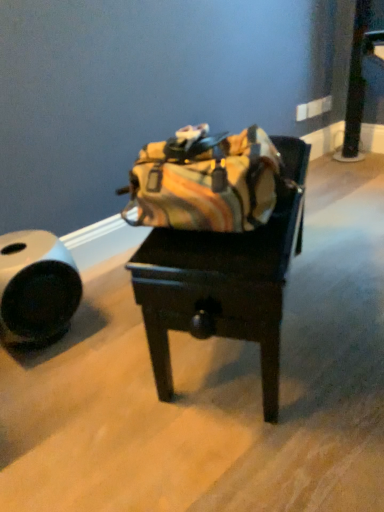
Measure the distance between point (26, 261) and camera.

The depth of point (26, 261) is 4.03 feet.

The width and height of the screenshot is (384, 512). What do you see at coordinates (36, 287) in the screenshot?
I see `white matte tube at left` at bounding box center [36, 287].

At what (x,y) coordinates should I click in order to perform the action: click on white matte tube at left. Please return your answer as a coordinate pair (x, y). The image size is (384, 512). Looking at the image, I should click on (36, 287).

This screenshot has width=384, height=512. Describe the element at coordinates (224, 280) in the screenshot. I see `leather duffel bag at center` at that location.

Where is `leather duffel bag at center`? leather duffel bag at center is located at coordinates (224, 280).

The image size is (384, 512). What are the coordinates of `white matte tube at left` in the screenshot? It's located at (36, 287).

Looking at this image, considering the relative positions of leather duffel bag at center and white matte tube at left in the image provided, is leather duffel bag at center to the right of white matte tube at left from the viewer's perspective?

Yes, leather duffel bag at center is to the right of white matte tube at left.

Is leather duffel bag at center in front of or behind white matte tube at left in the image?

Visually, leather duffel bag at center is located in front of white matte tube at left.

Is point (229, 281) positioned in front of point (30, 339)?

Yes, it is in front of point (30, 339).

From the picture: From the image's perspective, is leather duffel bag at center below white matte tube at left?

No, from the image's perspective, leather duffel bag at center is not below white matte tube at left.

From a real-world perspective, which is physically above, leather duffel bag at center or white matte tube at left?

leather duffel bag at center, from a real-world perspective.

Looking at this image, is leather duffel bag at center thinner than white matte tube at left?

No.

Does leather duffel bag at center have a lesser height compared to white matte tube at left?

Incorrect, the height of leather duffel bag at center does not fall short of that of white matte tube at left.

Who is bigger, leather duffel bag at center or white matte tube at left?

leather duffel bag at center is bigger.

Is white matte tube at left surrounded by leather duffel bag at center?

Actually, white matte tube at left is outside leather duffel bag at center.

Is leather duffel bag at center in contact with white matte tube at left?

No.

Is leather duffel bag at center positioned with its back to white matte tube at left?

Yes.

Find the location of `tube directly beneath the leather duffel bag at center (from a real-world perspective)`. tube directly beneath the leather duffel bag at center (from a real-world perspective) is located at coordinates (36, 287).

Based on their positions, is white matte tube at left located to the left or right of leather duffel bag at center?

Based on their positions, white matte tube at left is located to the left of leather duffel bag at center.

Between white matte tube at left and leather duffel bag at center, which one is positioned behind?

white matte tube at left.

Does point (65, 316) lie in front of point (246, 325)?

No, (65, 316) is behind (246, 325).

From the image's perspective, is white matte tube at left below leather duffel bag at center?

Correct, white matte tube at left appears lower than leather duffel bag at center in the image.

From a real-world perspective, who is located higher, white matte tube at left or leather duffel bag at center?

leather duffel bag at center is physically above.

In terms of width, does white matte tube at left look wider or thinner when compared to leather duffel bag at center?

white matte tube at left is thinner than leather duffel bag at center.

Does white matte tube at left have a greater height compared to leather duffel bag at center?

No, white matte tube at left is not taller than leather duffel bag at center.

Considering the relative sizes of white matte tube at left and leather duffel bag at center in the image provided, is white matte tube at left smaller than leather duffel bag at center?

Yes.

Based on the photo, is white matte tube at left inside the boundaries of leather duffel bag at center, or outside?

white matte tube at left exists outside the volume of leather duffel bag at center.

Are white matte tube at left and leather duffel bag at center located far from each other?

Actually, white matte tube at left and leather duffel bag at center are a little close together.

Is white matte tube at left facing away from leather duffel bag at center?

white matte tube at left does not have its back to leather duffel bag at center.

From the picture: Can you tell me how much white matte tube at left and leather duffel bag at center differ in facing direction?

27.9 degrees.

Find the location of a particular element. This screenshot has height=512, width=384. furniture lying in front of the white matte tube at left is located at coordinates (224, 280).

Find the location of a particular element. The width and height of the screenshot is (384, 512). tube behind the leather duffel bag at center is located at coordinates (36, 287).

Where is `furniture lying in front of the white matte tube at left`? Image resolution: width=384 pixels, height=512 pixels. furniture lying in front of the white matte tube at left is located at coordinates (224, 280).